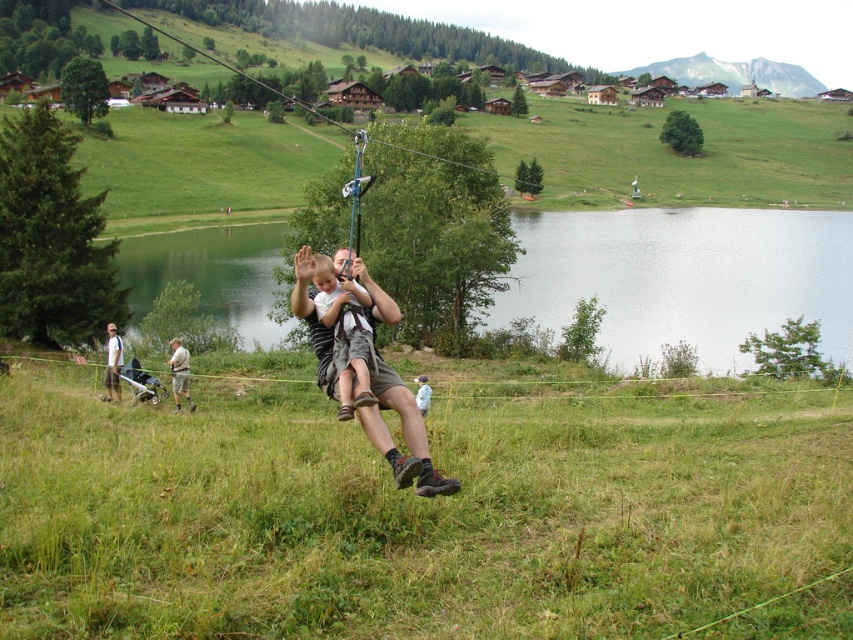
Question: Considering the real-world distances, which object is closest to the light brown fabric shorts at center?

Choices:
 (A) green water at center
 (B) khaki shorts at lower left
 (C) light brown fabric child at center
 (D) light brown fabric shirt at lower left

Answer: (C)

Question: Which point is farther from the camera taking this photo?

Choices:
 (A) (114, 340)
 (B) (178, 406)

Answer: (B)

Question: Which of these objects is positioned farthest from the white fabric at center?

Choices:
 (A) green water at center
 (B) light brown fabric child at center

Answer: (A)

Question: Considering the relative positions of light brown fabric shorts at center and light brown fabric shirt at lower left in the image provided, where is light brown fabric shorts at center located with respect to light brown fabric shirt at lower left?

Choices:
 (A) below
 (B) above

Answer: (B)

Question: Is light brown fabric child at center above white fabric at center?

Choices:
 (A) yes
 (B) no

Answer: (A)

Question: Can you confirm if light brown fabric shorts at center is bigger than light brown fabric shirt at lower left?

Choices:
 (A) no
 (B) yes

Answer: (A)